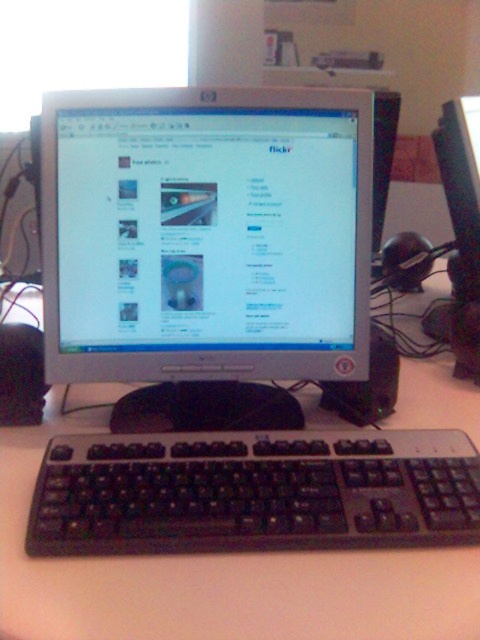
You are organizing a desk space and need to place a new monitor. Given the current setup, where is the silver metallic monitor at center located relative to the white plastic computer desk at center?

The silver metallic monitor at center is above the white plastic computer desk at center.

You are setting up a new monitor on your desk. The silver metallic monitor at center is taller than the white plastic computer desk at center. Can the monitor be placed on the desk without exceeding its height?

The silver metallic monitor at center is taller than the white plastic computer desk at center, so placing it on the desk would cause the monitor to exceed the desk height.